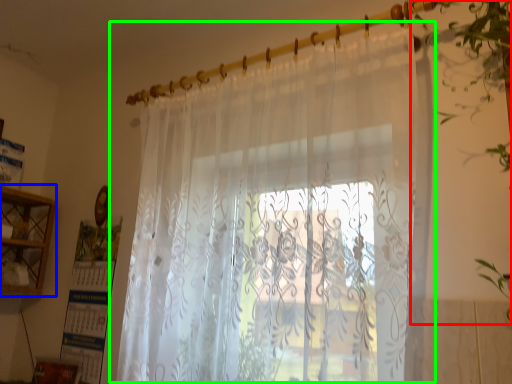
Question: Which object is the closest to the vegetation (highlighted by a red box)? Choose among these: cabinet (highlighted by a blue box) or curtain (highlighted by a green box).

Choices:
 (A) cabinet
 (B) curtain

Answer: (B)